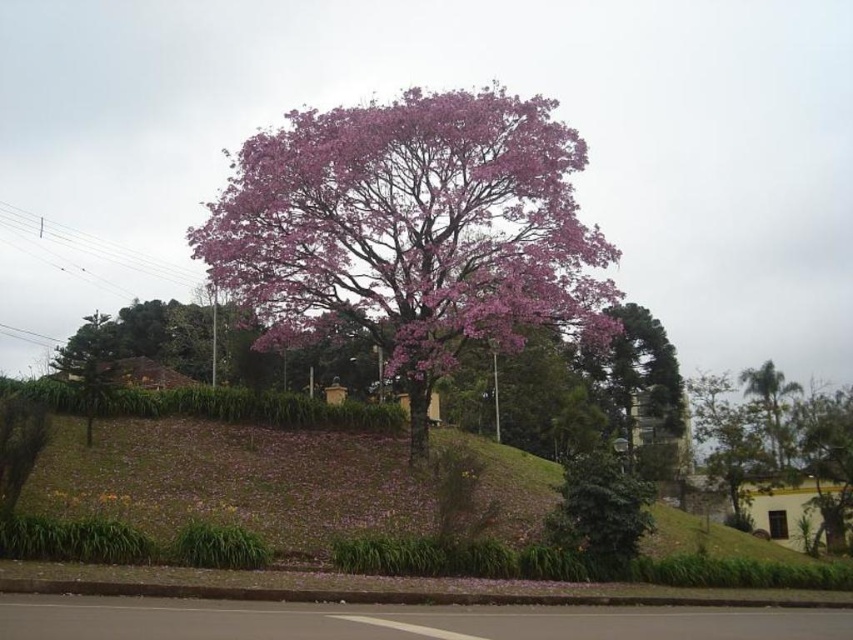
You are a gardener planning to place a new bench between the pink matte tree at center and the green leafy palm at right. Based on their sizes, which tree should the bench be closer to to ensure it doesn

The bench should be placed closer to the green leafy palm at right because the pink matte tree at center might be wider than the green leafy palm at right, so positioning the bench near the narrower tree would provide more space around the wider tree.

You are standing at the base of the large pink blossomed tree and want to walk towards the point labeled point (770, 400). However, there is an obstacle at point labeled point (431, 99). Will you encounter this obstacle before reaching your destination?

Yes, you will encounter the obstacle at point (431, 99) before reaching point (770, 400) because point (431, 99) is in front of point (770, 400).

You are standing at point A at point (511, 100). You want to walk to point B, which is 16.96 meters away from you. Is there a clear path between you and point B? Please explain your reasoning based on the scene description.

The scene describes a large tree with a sprawling canopy of vibrant pink blossoms dominating the center of the frame, situated on a gently sloping hill covered with green grass and scattered pink petals. Since there are no obstacles mentioned between point A and point B, and the ground is described as having grass and petals, there is likely a clear path between you and point B. However, the distance of 16.96 meters might require navigating around the tree or its branches, but the description does not state